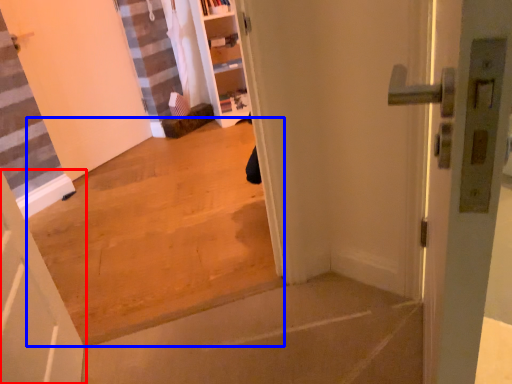
Question: Which object is further to the camera taking this photo, door (highlighted by a red box) or concrete (highlighted by a blue box)?

Choices:
 (A) door
 (B) concrete

Answer: (B)